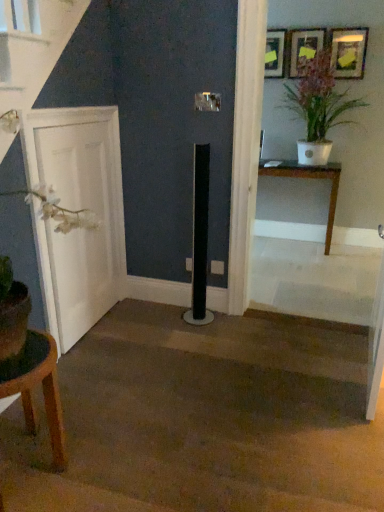
Image resolution: width=384 pixels, height=512 pixels. What are the coordinates of `space that is in front of wooden table at right, placed as the first table when sorted from top to bottom` in the screenshot? It's located at click(301, 264).